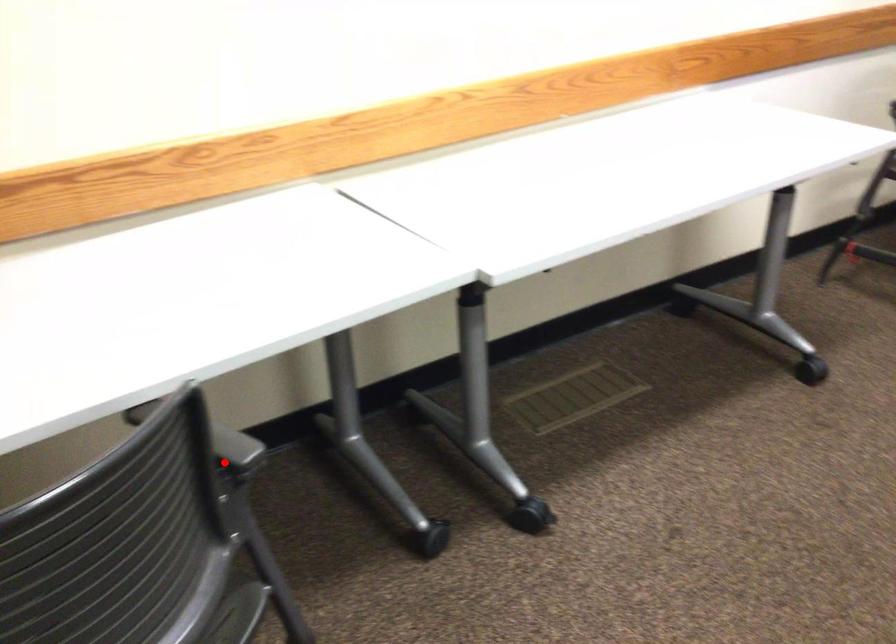
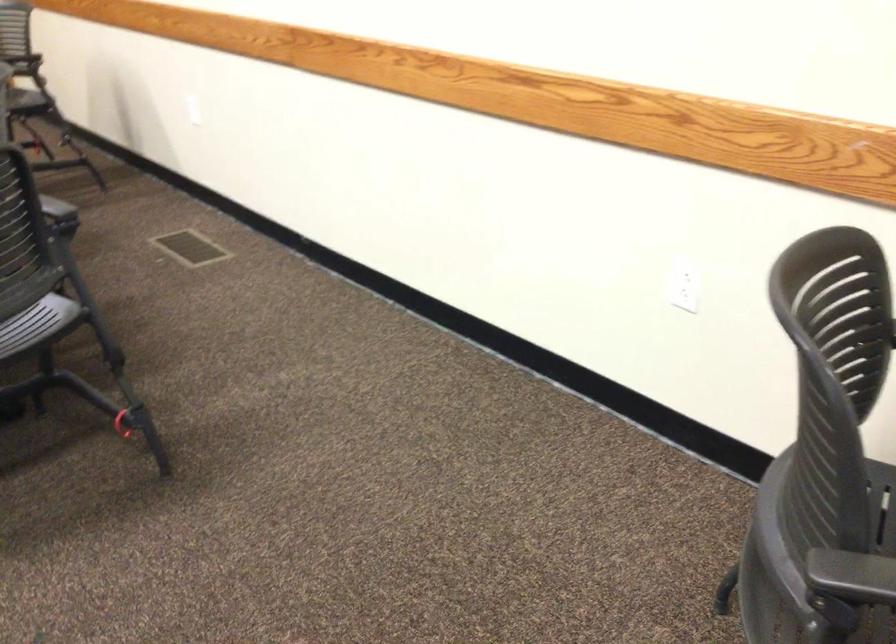
In the second image, find the point that corresponds to the highlighted location in the first image.

(850, 573)